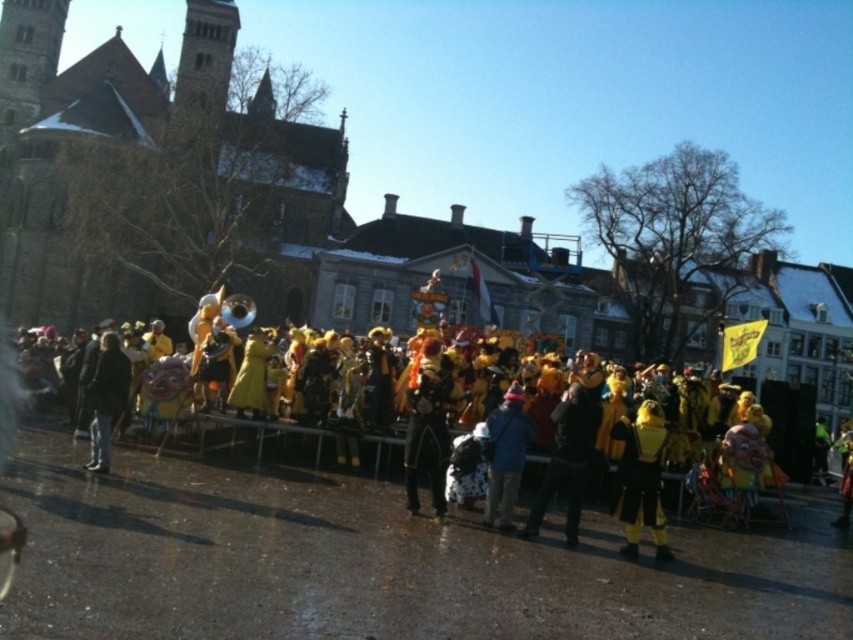
You are standing in the middle of the parade route and see two points marked in the image. The first point is at coordinate point(595, 433) and the second is at point(120, 403). Which point is closer to you?

Point(595, 433) is closer to the viewer than point(120, 403).

You are a photographer trying to capture a photo of the black matte jacket at center and the dark gray jacket at center. Since you want both jackets to be clearly visible in the photo, which jacket should you focus on first to ensure proper focus, considering their sizes in the frame?

The black matte jacket at center is much taller than the dark gray jacket at center, so you should focus on the black matte jacket at center first as it is larger and will require more precise focusing to ensure clarity.

You are a photographer at the event and want to capture both the black velvet costume at center and the orange velvet costume at center in the same frame. Which costume should you focus on to ensure both are visible without moving the camera?

The black velvet costume at center is smaller in size compared to the orange velvet costume at center, so focusing on the orange velvet costume at center will help ensure both are visible in the frame.